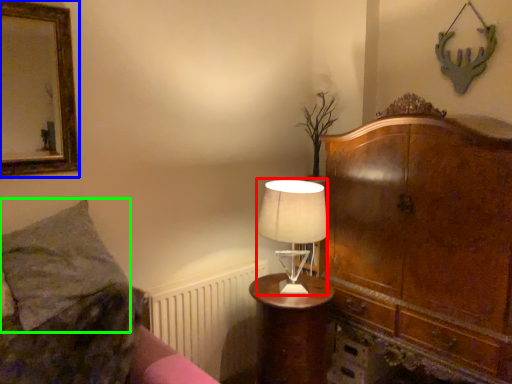
Question: Which object is positioned closest to table lamp (highlighted by a red box)? Select from picture frame (highlighted by a blue box) and pillow (highlighted by a green box).

Choices:
 (A) picture frame
 (B) pillow

Answer: (B)